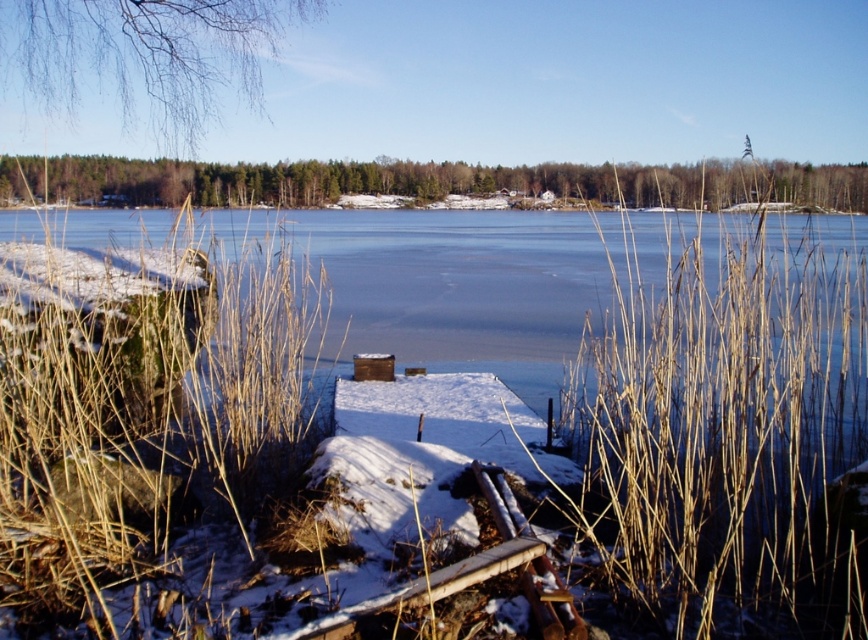
Question: Which point is closer to the camera?

Choices:
 (A) transparent ice at center
 (B) brown dry reed at center

Answer: (B)

Question: Does brown dry reed at center appear on the left side of transparent ice at center?

Choices:
 (A) no
 (B) yes

Answer: (A)

Question: Does brown dry reed at center appear under transparent ice at center?

Choices:
 (A) no
 (B) yes

Answer: (B)

Question: Which of these objects is positioned closest to the transparent ice at center?

Choices:
 (A) brown dry reed at lower left
 (B) brown dry reed at center

Answer: (A)

Question: Is brown dry reed at center positioned in front of transparent ice at center?

Choices:
 (A) yes
 (B) no

Answer: (A)

Question: Based on their relative distances, which object is nearer to the brown dry reed at center?

Choices:
 (A) brown dry reed at lower left
 (B) transparent ice at center

Answer: (A)